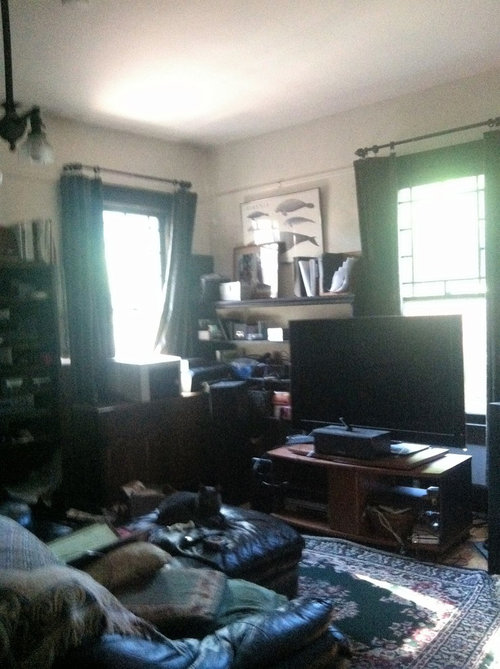
The height and width of the screenshot is (669, 500). In order to click on black leather sofa in this screenshot , I will do `click(294, 638)`.